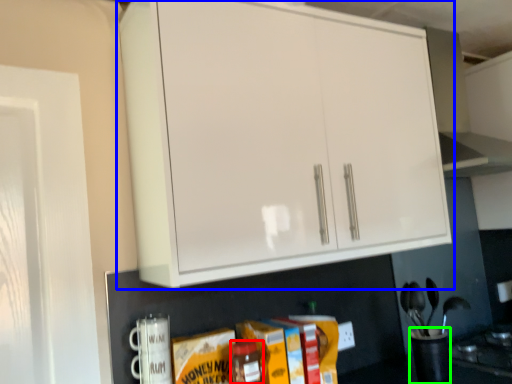
Question: Which object is the farthest from bottle (highlighted by a red box)? Choose among these: cabinetry (highlighted by a blue box) or appliance (highlighted by a green box).

Choices:
 (A) cabinetry
 (B) appliance

Answer: (A)